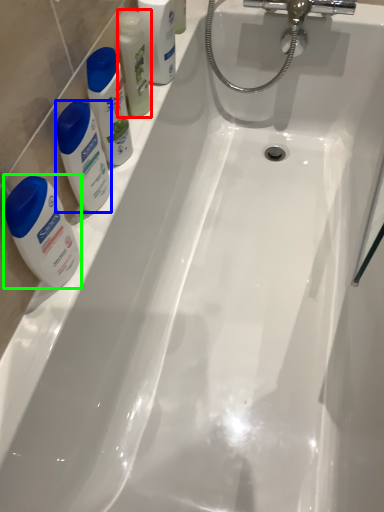
Question: Which object is positioned closest to mouthwash (highlighted by a red box)? Select from cleaning product (highlighted by a blue box) and toiletry (highlighted by a green box).

Choices:
 (A) cleaning product
 (B) toiletry

Answer: (A)